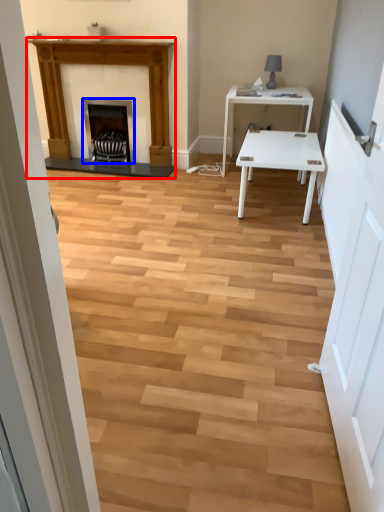
Question: Which point is closer to the camera, fireplace (highlighted by a red box) or fireplace (highlighted by a blue box)?

Choices:
 (A) fireplace
 (B) fireplace

Answer: (A)